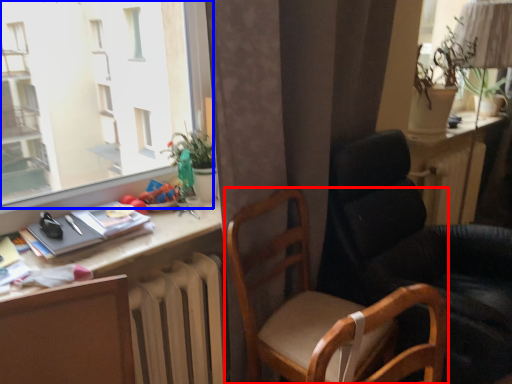
Question: Which point is closer to the camera, chair (highlighted by a red box) or window (highlighted by a blue box)?

Choices:
 (A) chair
 (B) window

Answer: (B)